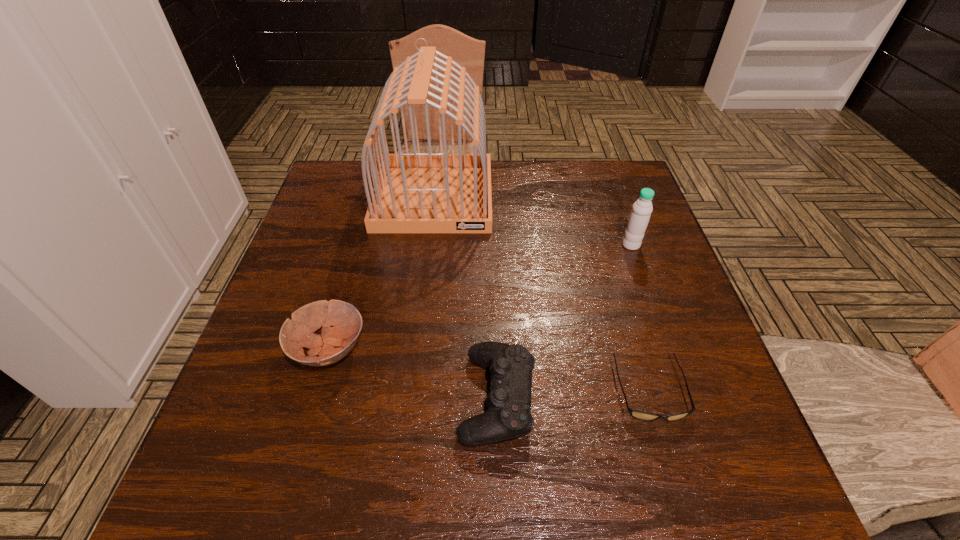
At what (x,y) coordinates should I click in order to perform the action: click on free space located on the left of the bowl. Please return your answer as a coordinate pair (x, y). The height and width of the screenshot is (540, 960). Looking at the image, I should click on (261, 349).

The image size is (960, 540). I want to click on free location located on the front-facing side of the shortest object, so click(x=669, y=454).

You are a GUI agent. You are given a task and a screenshot of the screen. Output one action in this format:
    pyautogui.click(x=<x>, y=<y>)
    Task: Click on the object that is at the far edge
    This screenshot has height=540, width=960.
    Given the screenshot: What is the action you would take?
    pyautogui.click(x=414, y=192)

In order to click on object that is at the left edge in this screenshot , I will do `click(334, 343)`.

The image size is (960, 540). I want to click on water bottle that is at the right edge, so [639, 217].

Identify the location of sunglasses situated at the right edge. (641, 415).

Where is `vacant space at the far edge of the desktop`? This screenshot has height=540, width=960. vacant space at the far edge of the desktop is located at coordinates (515, 173).

This screenshot has height=540, width=960. Identify the location of vacant space at the left edge of the desktop. (231, 411).

At what (x,y) coordinates should I click in order to perform the action: click on free space at the right edge of the desktop. Please return your answer as a coordinate pair (x, y). Looking at the image, I should click on (638, 320).

The image size is (960, 540). Find the location of `free space at the far left corner of the desktop`. free space at the far left corner of the desktop is located at coordinates (348, 198).